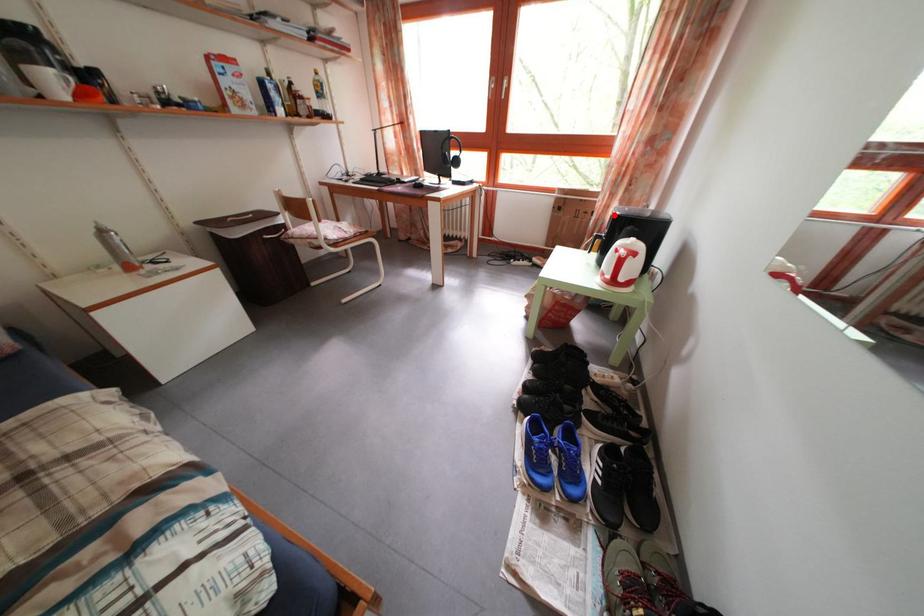
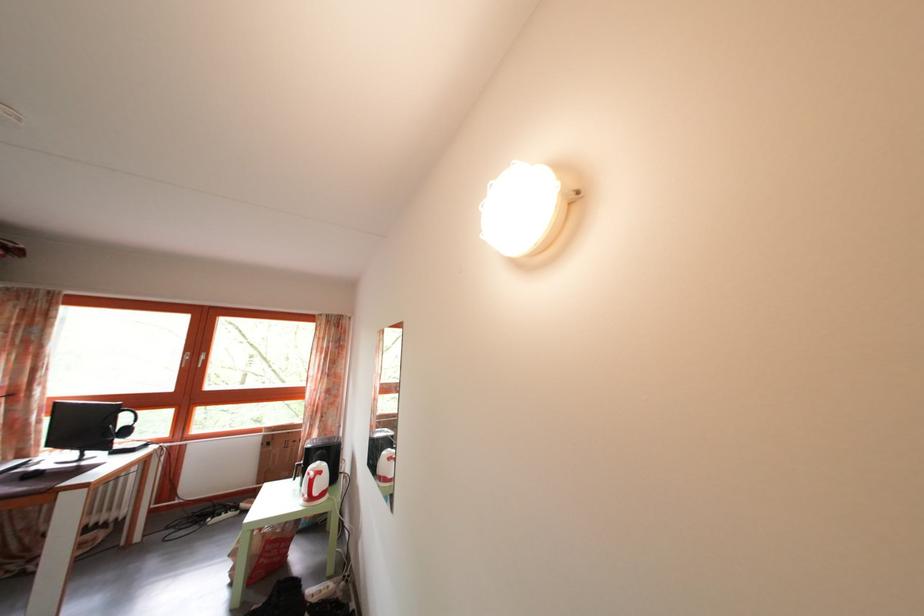
Question: I am providing you with two images of the same scene from different viewpoints. Image1 has a red point marked. In image2, the corresponding 3D location appears at what relative position? Reply with the corresponding letter.

Choices:
 (A) Closer
 (B) Farther

Answer: (B)